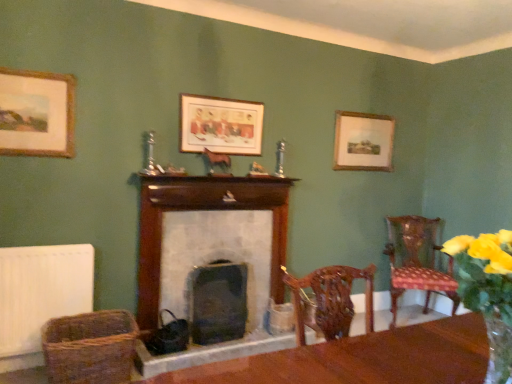
In order to click on blank space situated above wooden picture frame at upper right, the third picture frame viewed from the left (from a real-world perspective) in this screenshot , I will do `click(361, 114)`.